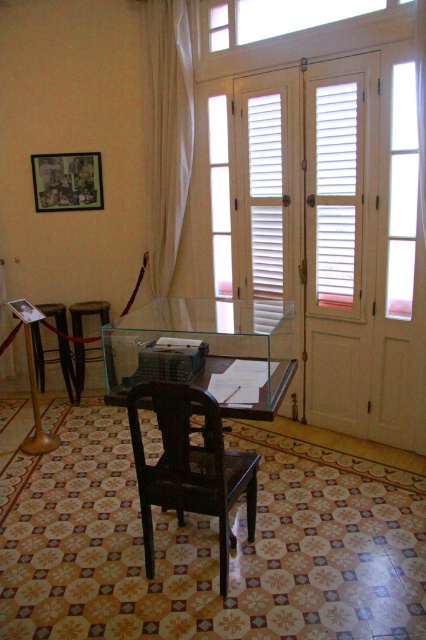
Question: Can you confirm if white wooden window at upper center is positioned above wooden stool at center?

Choices:
 (A) yes
 (B) no

Answer: (A)

Question: Estimate the real-world distances between objects in this image. Which object is closer to the white wooden window at upper center?

Choices:
 (A) transparent glass table at center
 (B) white wooden shutter at center

Answer: (B)

Question: In this image, where is black wicker chair at center located relative to white sheer curtain at upper left?

Choices:
 (A) right
 (B) left

Answer: (A)

Question: Which of the following is the farthest from the observer?

Choices:
 (A) white sheer curtain at upper left
 (B) black wicker chair at center
 (C) white wooden shutter at center

Answer: (A)

Question: From the image, what is the correct spatial relationship of white sheer curtain at upper left in relation to wooden stool at center?

Choices:
 (A) above
 (B) below

Answer: (A)

Question: Which point appears closest to the camera in this image?

Choices:
 (A) tap(178, 496)
 (B) tap(322, 176)

Answer: (A)